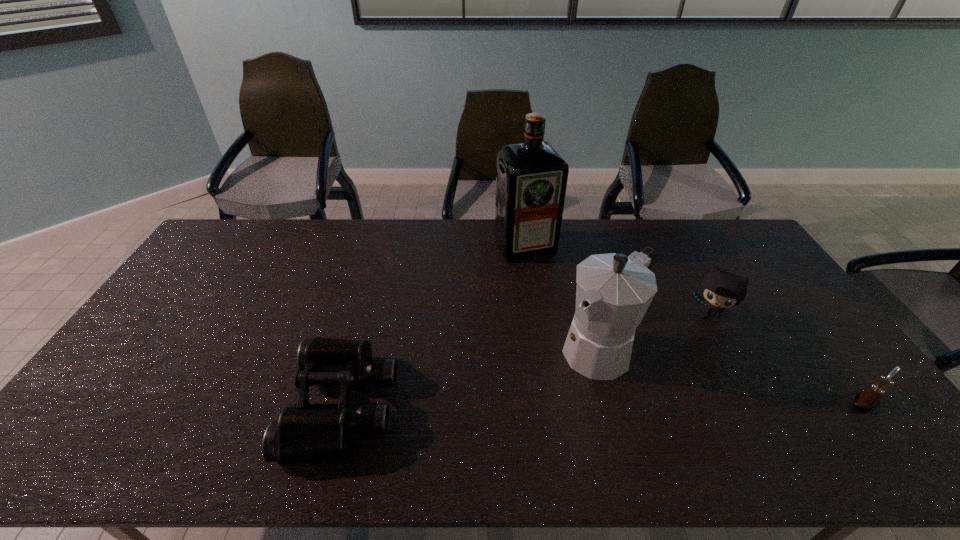
The height and width of the screenshot is (540, 960). Find the location of `object that is at the far edge`. object that is at the far edge is located at coordinates (531, 178).

You are a GUI agent. You are given a task and a screenshot of the screen. Output one action in this format:
    pyautogui.click(x=<x>, y=<y>)
    Task: Click on the binoculars that is positioned at the near edge
    
    Given the screenshot: What is the action you would take?
    pyautogui.click(x=305, y=432)

This screenshot has width=960, height=540. I want to click on padlock located at the near edge, so click(x=867, y=400).

In order to click on object at the right edge in this screenshot , I will do `click(867, 400)`.

Identify the location of object at the near right corner. (867, 400).

At what (x,y) coordinates should I click in order to perform the action: click on vacant area at the far edge of the desktop. Please return your answer as a coordinate pair (x, y). Looking at the image, I should click on (300, 256).

In the image, there is a desktop. Where is `vacant space at the near edge`? The height and width of the screenshot is (540, 960). vacant space at the near edge is located at coordinates (626, 407).

Locate an element on the screen. The height and width of the screenshot is (540, 960). vacant space at the right edge of the desktop is located at coordinates (832, 372).

The image size is (960, 540). In order to click on unoccupied area between the leftmost object and the third shortest object in this screenshot , I will do `click(526, 361)`.

Identify the location of free space between the leftmost object and the tallest object. The width and height of the screenshot is (960, 540). (434, 326).